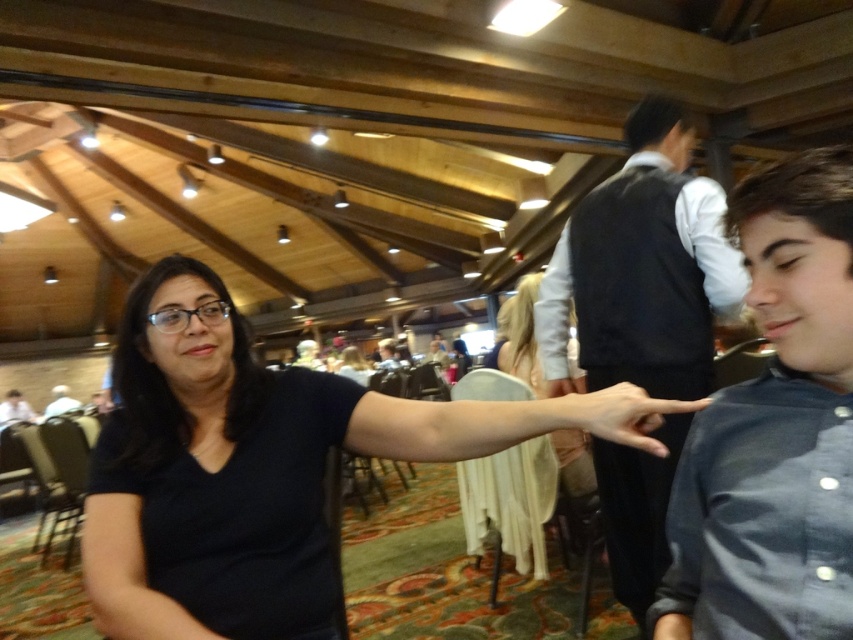
Based on the photo, does blue denim shirt at right have a greater width compared to white fabric at upper left?

In fact, blue denim shirt at right might be narrower than white fabric at upper left.

Is point (753, 276) farther from viewer compared to point (51, 400)?

No.

Locate an element on the screen. This screenshot has height=640, width=853. blue denim shirt at right is located at coordinates (775, 429).

Who is positioned more to the left, black matte shirt at center or matte skin hand at center?

Positioned to the left is black matte shirt at center.

Can you confirm if black matte shirt at center is wider than matte skin hand at center?

Correct, the width of black matte shirt at center exceeds that of matte skin hand at center.

Identify the location of black matte shirt at center. The image size is (853, 640). (247, 468).

Between point (833, 486) and point (700, 406), which one is positioned in front?

Point (833, 486) is in front.

Measure the distance from blue denim shirt at right to matte skin hand at center.

blue denim shirt at right and matte skin hand at center are 16.05 centimeters apart.

This screenshot has width=853, height=640. I want to click on blue denim shirt at right, so click(x=775, y=429).